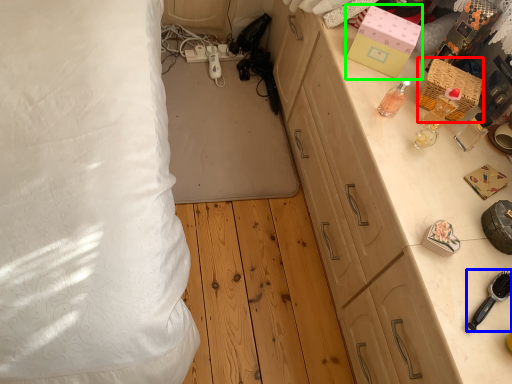
Question: Based on their relative distances, which object is nearer to box (highlighted by a red box)? Choose from brush (highlighted by a blue box) and box (highlighted by a green box).

Choices:
 (A) brush
 (B) box

Answer: (B)